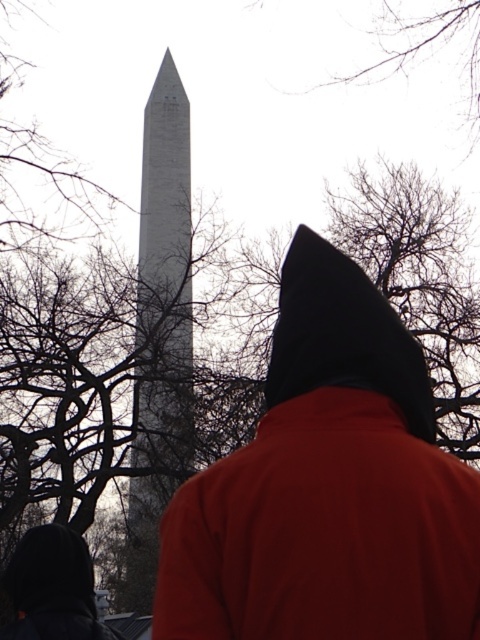
Is matte black hood at center to the left of white stone tower at center from the viewer's perspective?

In fact, matte black hood at center is to the right of white stone tower at center.

Based on the photo, is matte black hood at center to the right of white stone tower at center from the viewer's perspective?

Indeed, matte black hood at center is positioned on the right side of white stone tower at center.

Which is in front, point (422, 493) or point (165, 492)?

Positioned in front is point (422, 493).

At what (x,y) coordinates should I click in order to perform the action: click on matte black hood at center. Please return your answer as a coordinate pair (x, y). The image size is (480, 640). Looking at the image, I should click on (327, 486).